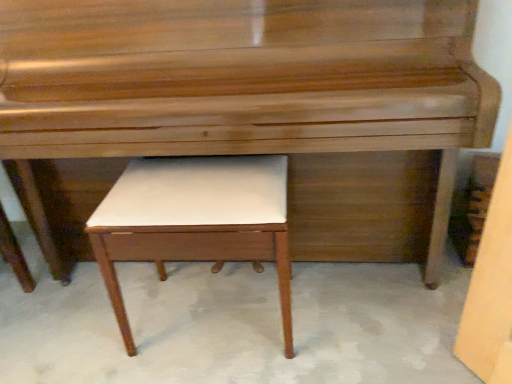
This screenshot has height=384, width=512. Describe the element at coordinates (241, 83) in the screenshot. I see `glossy wood piano at center` at that location.

You are a GUI agent. You are given a task and a screenshot of the screen. Output one action in this format:
    pyautogui.click(x=<x>, y=<y>)
    Task: Click on the glossy wood piano at center
    
    Given the screenshot: What is the action you would take?
    pyautogui.click(x=241, y=83)

Identify the location of white leather stool at center. This screenshot has height=384, width=512. (195, 221).

What do you see at coordinates (195, 221) in the screenshot? This screenshot has height=384, width=512. I see `white leather stool at center` at bounding box center [195, 221].

In order to click on glossy wood piano at center in this screenshot , I will do `click(241, 83)`.

Considering the positions of objects glossy wood piano at center and white leather stool at center in the image provided, who is more to the right, glossy wood piano at center or white leather stool at center?

Positioned to the right is glossy wood piano at center.

Is glossy wood piano at center further to camera compared to white leather stool at center?

No, it is in front of white leather stool at center.

Considering the points (181, 148) and (164, 192), which point is in front, point (181, 148) or point (164, 192)?

The point (181, 148) is closer to the camera.

From the image's perspective, is glossy wood piano at center located beneath white leather stool at center?

Actually, glossy wood piano at center appears above white leather stool at center in the image.

From a real-world perspective, is glossy wood piano at center located beneath white leather stool at center?

No, from a real-world perspective, glossy wood piano at center is not below white leather stool at center.

Does glossy wood piano at center have a greater width compared to white leather stool at center?

Indeed, glossy wood piano at center has a greater width compared to white leather stool at center.

Who is shorter, glossy wood piano at center or white leather stool at center?

white leather stool at center.

Looking at the image, does glossy wood piano at center seem bigger or smaller compared to white leather stool at center?

In the image, glossy wood piano at center appears to be larger than white leather stool at center.

Can we say glossy wood piano at center lies outside white leather stool at center?

glossy wood piano at center lies outside white leather stool at center's area.

Would you say glossy wood piano at center is a long distance from white leather stool at center?

No, there isn't a large distance between glossy wood piano at center and white leather stool at center.

Is glossy wood piano at center facing away from white leather stool at center?

That's right, glossy wood piano at center is facing away from white leather stool at center.

The image size is (512, 384). In order to click on piano above the white leather stool at center (from a real-world perspective) in this screenshot , I will do `click(241, 83)`.

Would you say white leather stool at center is to the left or to the right of glossy wood piano at center in the picture?

In the image, white leather stool at center appears on the left side of glossy wood piano at center.

Based on the photo, does white leather stool at center lie behind glossy wood piano at center?

That is True.

Considering the positions of point (261, 195) and point (349, 88), is point (261, 195) closer or farther from the camera than point (349, 88)?

Point (261, 195) is positioned farther from the camera compared to point (349, 88).

From the image's perspective, which one is positioned higher, white leather stool at center or glossy wood piano at center?

From the image's view, glossy wood piano at center is above.

From a real-world perspective, which is physically above, white leather stool at center or glossy wood piano at center?

glossy wood piano at center, from a real-world perspective.

In the scene shown: Is white leather stool at center wider or thinner than glossy wood piano at center?

In the image, white leather stool at center appears to be more narrow than glossy wood piano at center.

Between white leather stool at center and glossy wood piano at center, which one has more height?

glossy wood piano at center.

Considering the sizes of objects white leather stool at center and glossy wood piano at center in the image provided, who is smaller, white leather stool at center or glossy wood piano at center?

white leather stool at center is smaller.

Is glossy wood piano at center located within white leather stool at center?

Actually, glossy wood piano at center is outside white leather stool at center.

Are white leather stool at center and glossy wood piano at center far apart?

That's not correct — white leather stool at center is a little close to glossy wood piano at center.

Does white leather stool at center turn towards glossy wood piano at center?

Yes, white leather stool at center is turned towards glossy wood piano at center.

How different are the orientations of white leather stool at center and glossy wood piano at center in degrees?

white leather stool at center and glossy wood piano at center are facing 0.573 degrees away from each other.

Measure the distance from white leather stool at center to glossy wood piano at center.

They are 9.98 inches apart.

The image size is (512, 384). I want to click on table directly beneath the glossy wood piano at center (from a real-world perspective), so click(x=195, y=221).

Identify the location of table located on the left of glossy wood piano at center. This screenshot has width=512, height=384. (195, 221).

In the image, there is a glossy wood piano at center. At what (x,y) coordinates should I click in order to perform the action: click on table below it (from a real-world perspective). Please return your answer as a coordinate pair (x, y). The image size is (512, 384). Looking at the image, I should click on (195, 221).